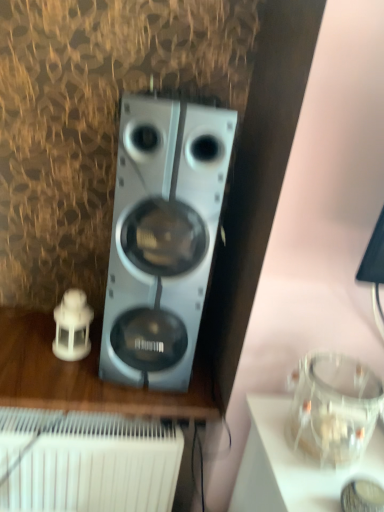
Question: Is the position of satin silver speaker at center less distant than that of white plastic speaker at left?

Choices:
 (A) yes
 (B) no

Answer: (A)

Question: From a real-world perspective, is satin silver speaker at center physically below white plastic speaker at left?

Choices:
 (A) yes
 (B) no

Answer: (B)

Question: From a real-world perspective, is satin silver speaker at center on top of white plastic speaker at left?

Choices:
 (A) yes
 (B) no

Answer: (A)

Question: Is satin silver speaker at center oriented towards white plastic speaker at left?

Choices:
 (A) yes
 (B) no

Answer: (B)

Question: From the image's perspective, is satin silver speaker at center under white plastic speaker at left?

Choices:
 (A) yes
 (B) no

Answer: (B)

Question: Does satin silver speaker at center have a larger size compared to white plastic speaker at left?

Choices:
 (A) no
 (B) yes

Answer: (B)

Question: Is satin silver speaker at center outside white plastic radiator at lower left?

Choices:
 (A) yes
 (B) no

Answer: (A)

Question: Is satin silver speaker at center wider than white plastic radiator at lower left?

Choices:
 (A) yes
 (B) no

Answer: (B)

Question: Considering the relative sizes of satin silver speaker at center and white plastic radiator at lower left in the image provided, is satin silver speaker at center shorter than white plastic radiator at lower left?

Choices:
 (A) yes
 (B) no

Answer: (B)

Question: From the image's perspective, is satin silver speaker at center on white plastic radiator at lower left?

Choices:
 (A) no
 (B) yes

Answer: (B)

Question: Is satin silver speaker at center looking in the opposite direction of white plastic radiator at lower left?

Choices:
 (A) no
 (B) yes

Answer: (A)

Question: Is satin silver speaker at center to the right of white plastic radiator at lower left from the viewer's perspective?

Choices:
 (A) no
 (B) yes

Answer: (B)

Question: Does white plastic speaker at left appear on the left side of white plastic radiator at lower left?

Choices:
 (A) no
 (B) yes

Answer: (A)